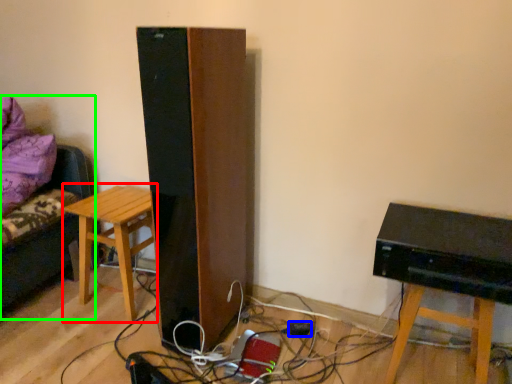
Question: Which is nearer to the stool (highlighted by a red box)? plug (highlighted by a blue box) or furniture (highlighted by a green box).

Choices:
 (A) plug
 (B) furniture

Answer: (B)